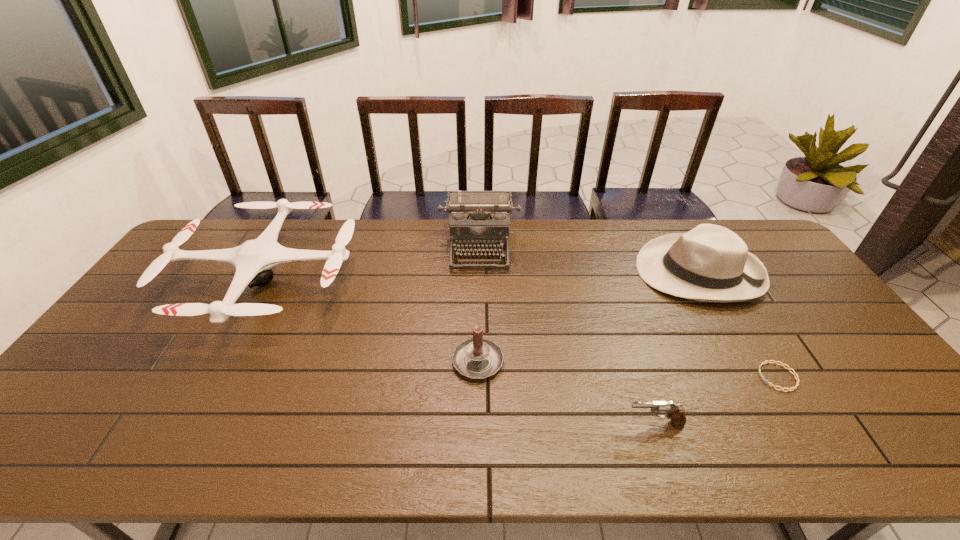
The width and height of the screenshot is (960, 540). What are the coordinates of `vacant space at the near edge of the desktop` in the screenshot? It's located at (641, 441).

Locate an element on the screen. free space at the left edge of the desktop is located at coordinates (166, 273).

In the image, there is a desktop. Where is `vacant space at the right edge`? The image size is (960, 540). vacant space at the right edge is located at coordinates (855, 393).

This screenshot has width=960, height=540. What are the coordinates of `free region at the far left corner` in the screenshot? It's located at (225, 239).

The height and width of the screenshot is (540, 960). I want to click on vacant area that lies between the typewriter and the candle, so click(x=479, y=303).

Where is `free space between the drone and the candle`? free space between the drone and the candle is located at coordinates coord(372,320).

The height and width of the screenshot is (540, 960). I want to click on free space between the candle and the leftmost object, so click(x=372, y=320).

Where is `blank region between the second shortest object and the candle`? The height and width of the screenshot is (540, 960). blank region between the second shortest object and the candle is located at coordinates (566, 392).

Where is `free space between the bracelet and the fedora`? The width and height of the screenshot is (960, 540). free space between the bracelet and the fedora is located at coordinates (738, 325).

I want to click on vacant space in between the shortest object and the drone, so click(x=522, y=329).